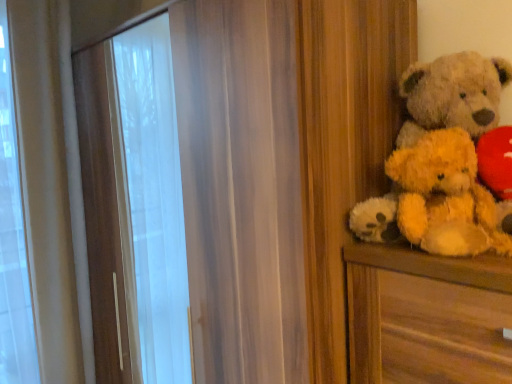
The image size is (512, 384). What do you see at coordinates (453, 95) in the screenshot? I see `fuzzy beige teddy bear at right` at bounding box center [453, 95].

Measure the distance between point (x=500, y=85) and camera.

Point (x=500, y=85) is 38.39 inches away from camera.

I want to click on fuzzy beige teddy bear at right, so coord(453,95).

Describe the element at coordinates (445, 197) in the screenshot. This screenshot has height=384, width=512. I see `yellow plush teddy bear at right` at that location.

Measure the distance between yellow plush teddy bear at right and camera.

yellow plush teddy bear at right and camera are 30.24 inches apart from each other.

Image resolution: width=512 pixels, height=384 pixels. What are the coordinates of `yellow plush teddy bear at right` in the screenshot? It's located at tap(445, 197).

Find the location of a particular element. This screenshot has width=512, height=384. fuzzy beige teddy bear at right is located at coordinates (453, 95).

Is yellow plush teddy bear at right at the left side of fuzzy beige teddy bear at right?

Correct, you'll find yellow plush teddy bear at right to the left of fuzzy beige teddy bear at right.

Does yellow plush teddy bear at right come behind fuzzy beige teddy bear at right?

No, yellow plush teddy bear at right is closer to the viewer.

Which is closer to the camera, (472, 176) or (417, 95)?

Point (472, 176).

From the image's perspective, is yellow plush teddy bear at right beneath fuzzy beige teddy bear at right?

Yes, from the image's perspective, yellow plush teddy bear at right is beneath fuzzy beige teddy bear at right.

From a real-world perspective, relative to fuzzy beige teddy bear at right, is yellow plush teddy bear at right vertically above or below?

Clearly, from a real-world perspective, yellow plush teddy bear at right is below fuzzy beige teddy bear at right.

Is yellow plush teddy bear at right thinner than fuzzy beige teddy bear at right?

Yes, yellow plush teddy bear at right is thinner than fuzzy beige teddy bear at right.

Is yellow plush teddy bear at right taller than fuzzy beige teddy bear at right?

No, yellow plush teddy bear at right is not taller than fuzzy beige teddy bear at right.

Is yellow plush teddy bear at right bigger or smaller than fuzzy beige teddy bear at right?

In the image, yellow plush teddy bear at right appears to be smaller than fuzzy beige teddy bear at right.

Is yellow plush teddy bear at right spatially inside fuzzy beige teddy bear at right, or outside of it?

yellow plush teddy bear at right fits inside fuzzy beige teddy bear at right.

Are yellow plush teddy bear at right and fuzzy beige teddy bear at right far apart?

No, yellow plush teddy bear at right is not far from fuzzy beige teddy bear at right.

Is yellow plush teddy bear at right turned away from fuzzy beige teddy bear at right?

That's right, yellow plush teddy bear at right is facing away from fuzzy beige teddy bear at right.

Measure the distance between yellow plush teddy bear at right and fuzzy beige teddy bear at right.

yellow plush teddy bear at right and fuzzy beige teddy bear at right are 9.49 centimeters apart from each other.

The width and height of the screenshot is (512, 384). I want to click on teddy beneath the fuzzy beige teddy bear at right (from a real-world perspective), so click(x=445, y=197).

Is fuzzy beige teddy bear at right at the right side of yellow plush teddy bear at right?

Yes, fuzzy beige teddy bear at right is to the right of yellow plush teddy bear at right.

Relative to yellow plush teddy bear at right, is fuzzy beige teddy bear at right in front or behind?

In the image, fuzzy beige teddy bear at right appears behind yellow plush teddy bear at right.

Is point (426, 131) behind point (428, 210)?

Yes, it is.

From the image's perspective, between fuzzy beige teddy bear at right and yellow plush teddy bear at right, which one is located above?

fuzzy beige teddy bear at right is shown above in the image.

From a real-world perspective, which is physically above, fuzzy beige teddy bear at right or yellow plush teddy bear at right?

A: fuzzy beige teddy bear at right, from a real-world perspective.

Consider the image. Which of these two, fuzzy beige teddy bear at right or yellow plush teddy bear at right, is wider?

Wider between the two is fuzzy beige teddy bear at right.

Which of these two, fuzzy beige teddy bear at right or yellow plush teddy bear at right, stands taller?

fuzzy beige teddy bear at right is taller.

Does fuzzy beige teddy bear at right have a smaller size compared to yellow plush teddy bear at right?

No, fuzzy beige teddy bear at right is not smaller than yellow plush teddy bear at right.

Is yellow plush teddy bear at right located within fuzzy beige teddy bear at right?

Yes.

Are fuzzy beige teddy bear at right and yellow plush teddy bear at right making contact?

Yes, fuzzy beige teddy bear at right is right next to yellow plush teddy bear at right and making contact.

Is fuzzy beige teddy bear at right facing towards yellow plush teddy bear at right?

Yes.

How much distance is there between fuzzy beige teddy bear at right and yellow plush teddy bear at right?

They are 3.74 inches apart.

In order to click on teddy bear that appears on the right of yellow plush teddy bear at right in this screenshot , I will do `click(453, 95)`.

The width and height of the screenshot is (512, 384). In order to click on teddy bear lying behind the yellow plush teddy bear at right in this screenshot , I will do `click(453, 95)`.

At what (x,y) coordinates should I click in order to perform the action: click on teddy in front of the fuzzy beige teddy bear at right. Please return your answer as a coordinate pair (x, y). Image resolution: width=512 pixels, height=384 pixels. Looking at the image, I should click on (445, 197).